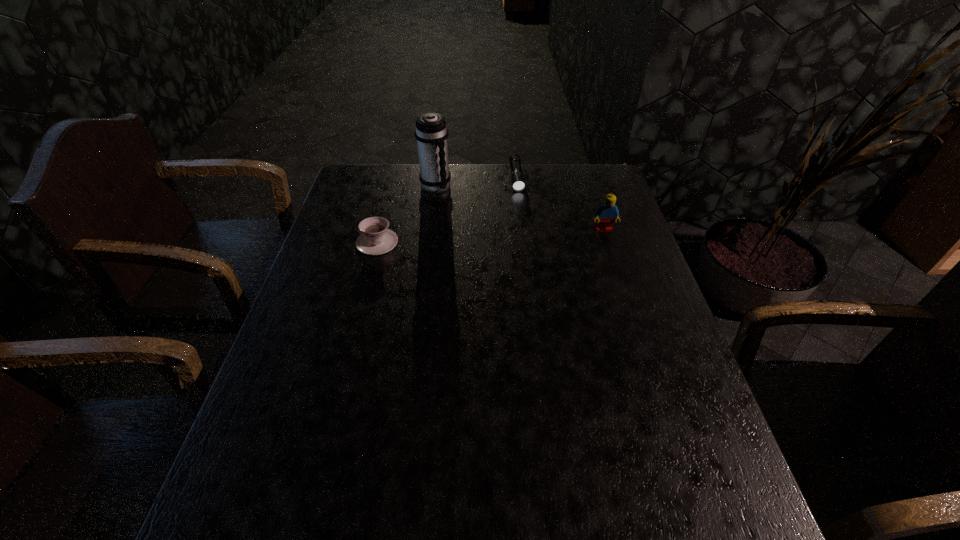
This screenshot has width=960, height=540. I want to click on object that is at the right edge, so click(605, 214).

In the image, there is a desktop. At what (x,y) coordinates should I click in order to perform the action: click on blank space at the far edge. Please return your answer as a coordinate pair (x, y). This screenshot has width=960, height=540. Looking at the image, I should click on (546, 170).

Locate an element on the screen. This screenshot has height=540, width=960. free space at the near edge of the desktop is located at coordinates (478, 439).

Locate an element on the screen. This screenshot has height=540, width=960. vacant area at the left edge of the desktop is located at coordinates (294, 329).

The height and width of the screenshot is (540, 960). Find the location of `free space at the right edge of the desktop`. free space at the right edge of the desktop is located at coordinates (623, 339).

You are a GUI agent. You are given a task and a screenshot of the screen. Output one action in this format:
    pyautogui.click(x=<x>, y=<y>)
    Task: Click on the free spot at the far left corner of the desktop
    The image size is (960, 540).
    Given the screenshot: What is the action you would take?
    pyautogui.click(x=348, y=181)

Identify the location of free space between the tallest object and the third tallest object. Image resolution: width=960 pixels, height=540 pixels. [x=406, y=215].

The height and width of the screenshot is (540, 960). Find the location of `free space between the teacup and the second tallest object`. free space between the teacup and the second tallest object is located at coordinates (491, 236).

You are a GUI agent. You are given a task and a screenshot of the screen. Output one action in this format:
    pyautogui.click(x=<x>, y=<y>)
    Task: Click on the empty space between the flashlight and the thermos bottle
    The height and width of the screenshot is (540, 960).
    Given the screenshot: What is the action you would take?
    pyautogui.click(x=476, y=183)

At what (x,y) coordinates should I click in order to perform the action: click on free area in between the rightmost object and the second shortest object. Please return your answer as a coordinate pair (x, y). The width and height of the screenshot is (960, 540). Looking at the image, I should click on (491, 236).